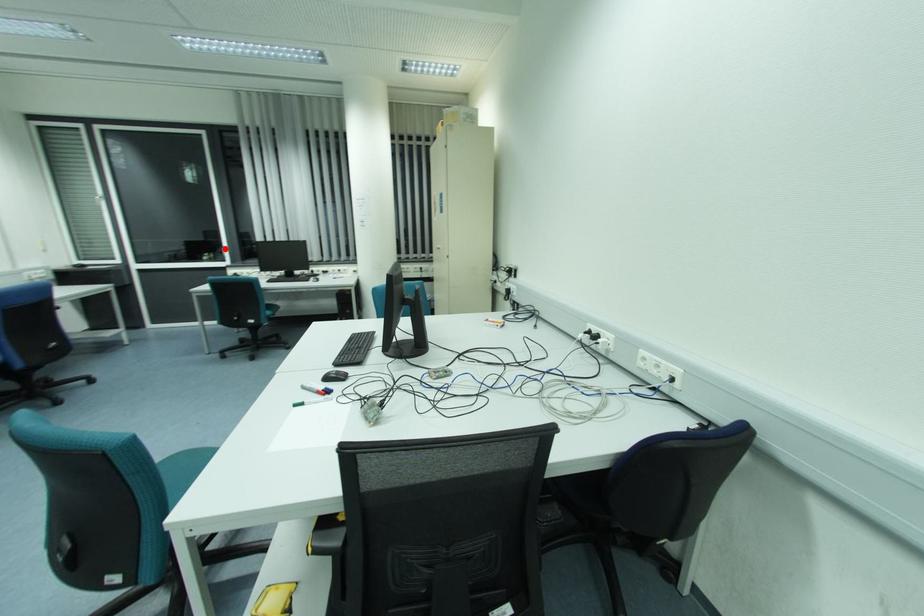
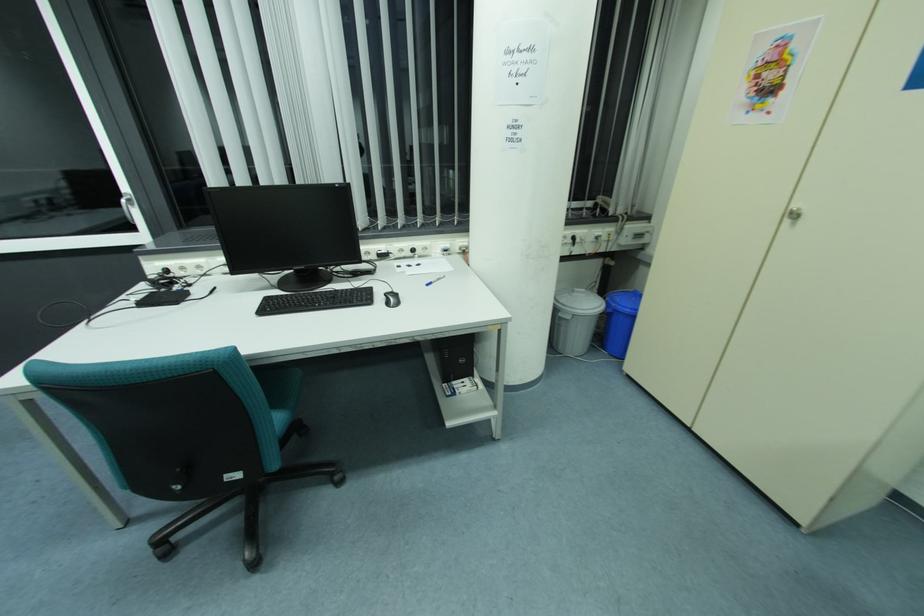
The point at the highlighted location is marked in the first image. Where is the corresponding point in the second image?

(125, 201)